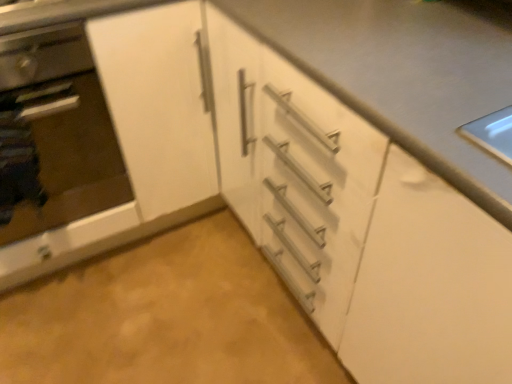
Question: Looking at their shapes, would you say white matte countertop at center is wider or thinner than white matte cabinet at center?

Choices:
 (A) wide
 (B) thin

Answer: (A)

Question: Is white matte countertop at center situated inside white matte cabinet at center or outside?

Choices:
 (A) inside
 (B) outside

Answer: (B)

Question: Which object is the closest to the white matte countertop at center?

Choices:
 (A) satin silver oven at left
 (B) white matte cabinet at center

Answer: (B)

Question: Which is nearer to the white matte cabinet at center?

Choices:
 (A) white matte countertop at center
 (B) satin silver oven at left

Answer: (B)